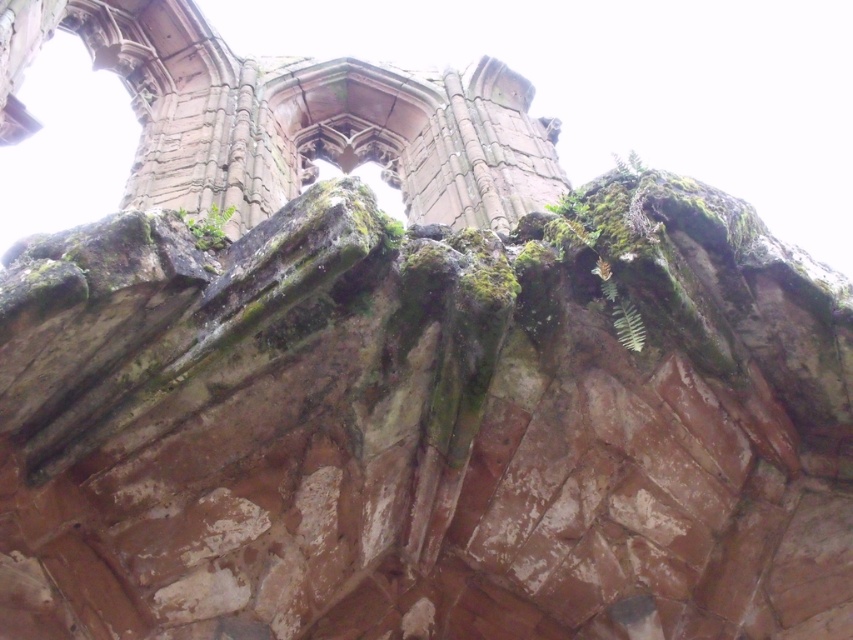
Can you confirm if green leafy plant at upper center is taller than green mossy rock at upper center?

Incorrect, green leafy plant at upper center's height is not larger of green mossy rock at upper center's.

This screenshot has height=640, width=853. What do you see at coordinates (619, 308) in the screenshot? I see `green leafy plant at upper center` at bounding box center [619, 308].

Where is `green leafy plant at upper center`? green leafy plant at upper center is located at coordinates click(x=619, y=308).